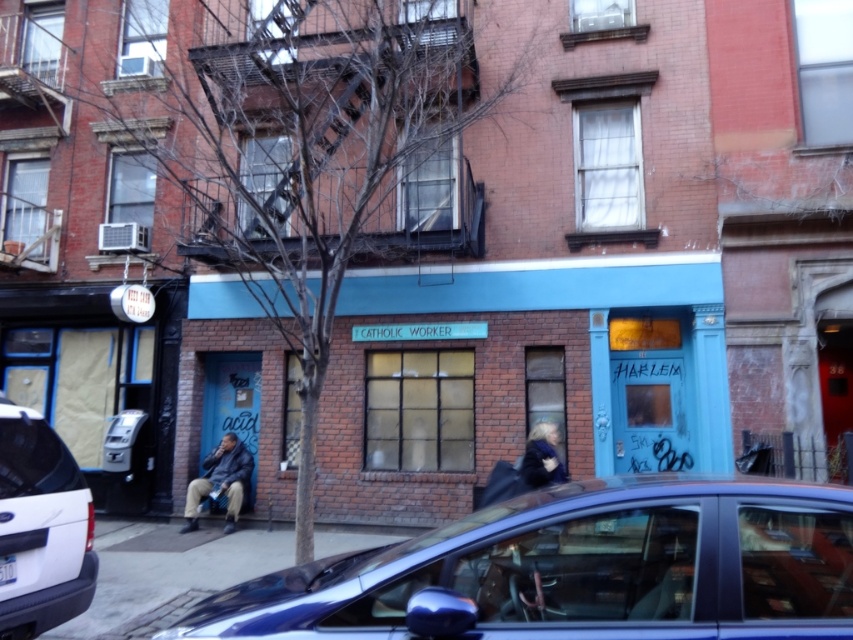
You are a delivery person trying to park your white matte suv at lower left near the teal storefront. The parking spot is marked by a point at coordinate (39, 528). Is your vehicle currently positioned at that parking spot?

The white matte suv at lower left is represented by point (39, 528), so yes, the vehicle is positioned at the parking spot marked by that coordinate.

You are a pedestrian standing at the entrance of the teal storefront. You want to cross the street to reach a park on the other side. There is a metallic blue sedan at lower center and a blue brick building at center in your view. Which object is closer to you as you prepare to cross?

The metallic blue sedan at lower center is closer to you than the blue brick building at center, so you should be cautious of the sedan when crossing the street.

You are a pedestrian standing in front of the teal storefront. You need to cross the street to reach the other side. Which vehicle, the metallic blue sedan at lower center or the white matte suv at lower left, is closer to you to ensure a safer crossing?

The metallic blue sedan at lower center is closer to the viewer, so it is safer to cross near it first as it is nearer than the white matte suv at lower left.